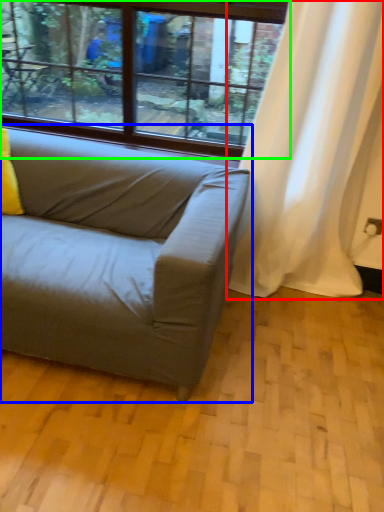
Question: Considering the real-world distances, which object is closest to curtain (highlighted by a red box)? studio couch (highlighted by a blue box) or window (highlighted by a green box).

Choices:
 (A) studio couch
 (B) window

Answer: (A)